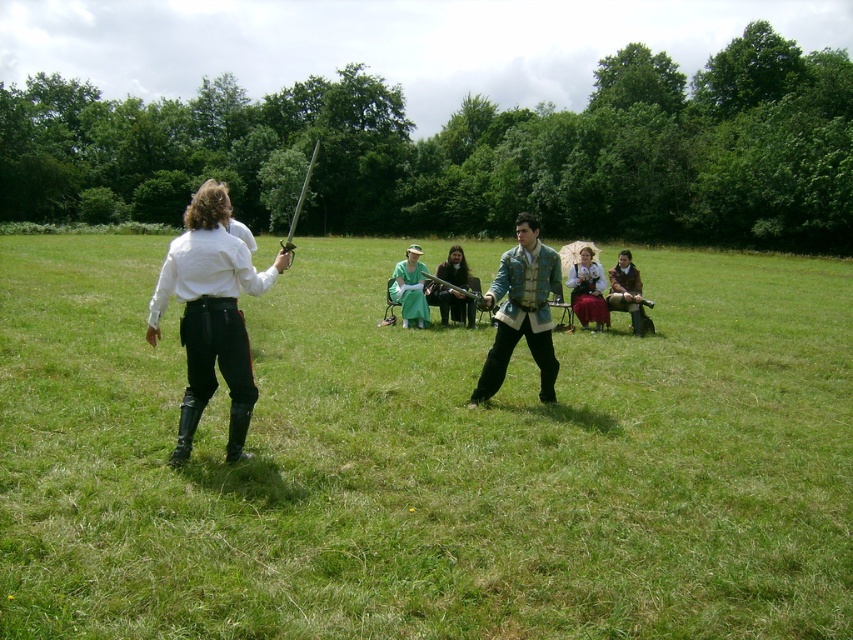
Question: Is the position of matte black sword at center more distant than that of polished silver sword at center?

Choices:
 (A) yes
 (B) no

Answer: (B)

Question: Observing the image, what is the correct spatial positioning of green grass at center in reference to polished silver sword at center?

Choices:
 (A) above
 (B) below

Answer: (A)

Question: Which point is farther from the camera taking this photo?

Choices:
 (A) (447, 285)
 (B) (500, 260)
 (C) (248, 401)
 (D) (427, 314)

Answer: (D)

Question: Which object appears closest to the camera in this image?

Choices:
 (A) matte black sword at center
 (B) white matte shirt at left
 (C) polished silver sword at center
 (D) brown leather jacket at center

Answer: (B)

Question: Considering the relative positions of green grass at center and matte green dress at center in the image provided, where is green grass at center located with respect to matte green dress at center?

Choices:
 (A) left
 (B) right

Answer: (A)

Question: Estimate the real-world distances between objects in this image. Which object is closer to the white matte shirt at left?

Choices:
 (A) blue-green velvet vest at center
 (B) brown leather jacket at center
 (C) matte green dress at center

Answer: (A)